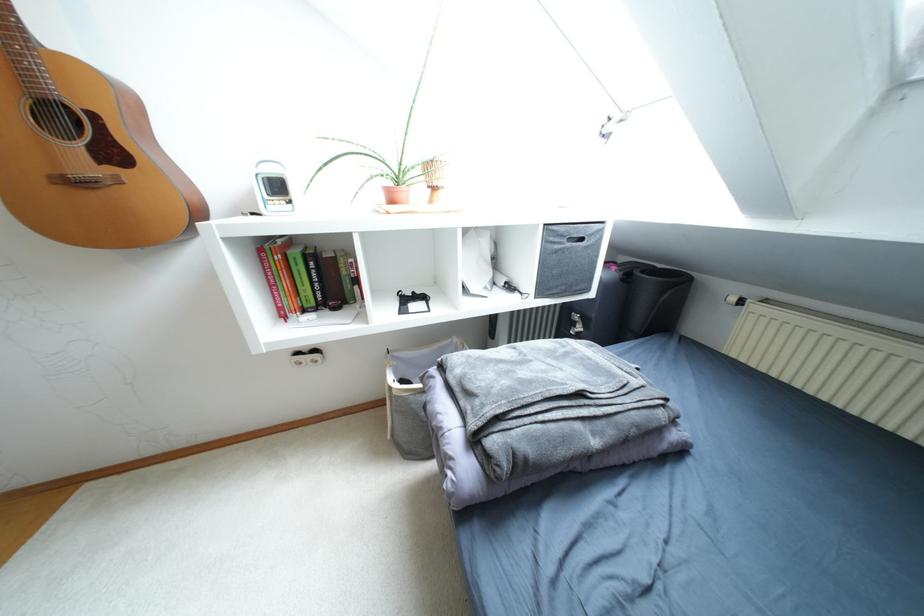
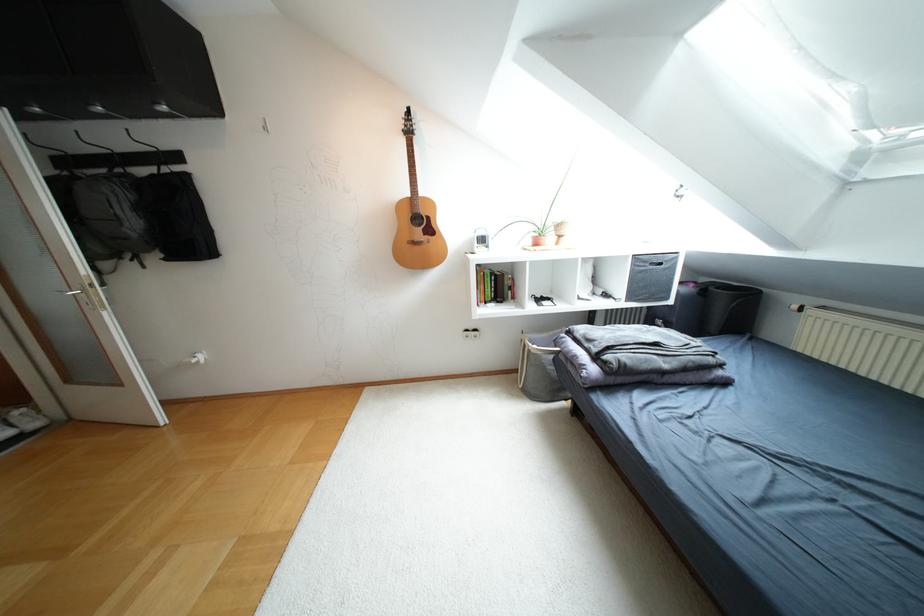
In the second image, find the point that corresponds to point 93,116 in the first image.

(428, 217)